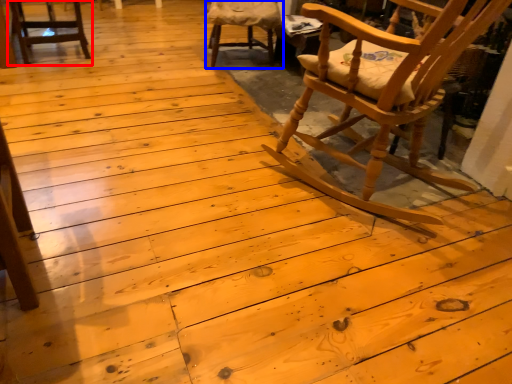
Question: Which object appears farthest to the camera in this image, chair (highlighted by a red box) or chair (highlighted by a blue box)?

Choices:
 (A) chair
 (B) chair

Answer: (B)